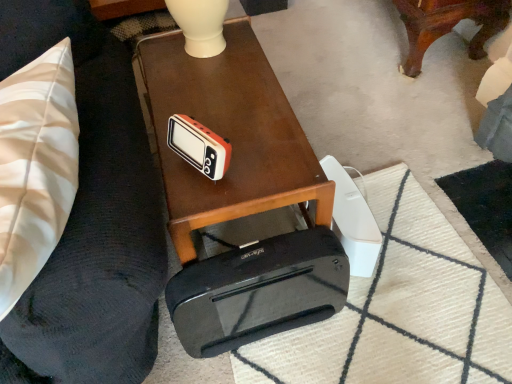
Locate an element on the screen. The width and height of the screenshot is (512, 384). vacant space behind orange matte clock at center is located at coordinates (214, 116).